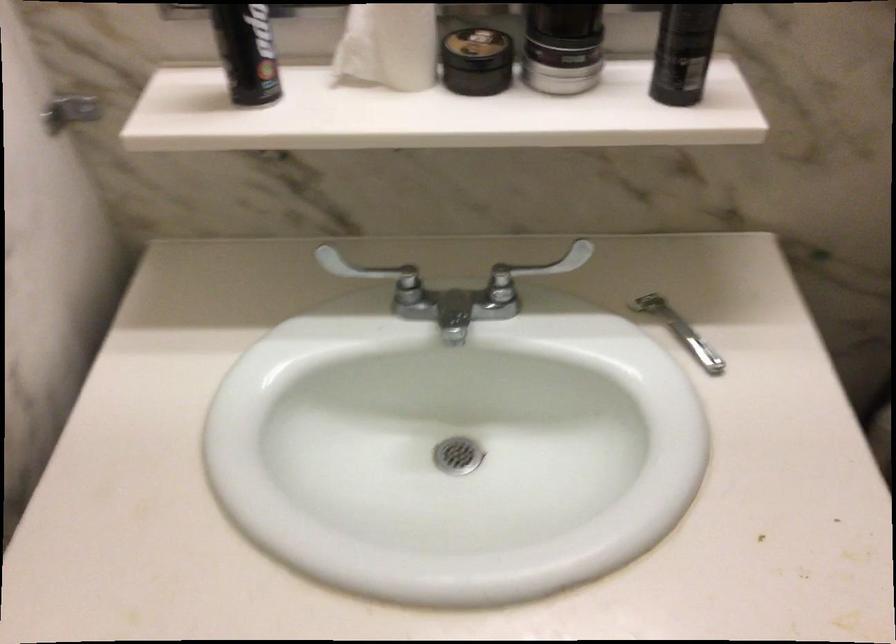
Image resolution: width=896 pixels, height=644 pixels. Identify the location of small black jar. (477, 61).